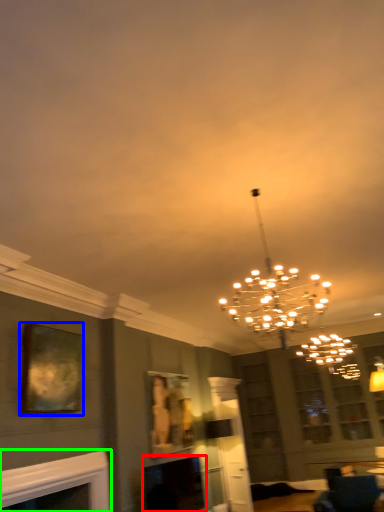
Question: Estimate the real-world distances between objects in this image. Which object is farther from fireplace (highlighted by a red box), picture frame (highlighted by a blue box) or fireplace (highlighted by a green box)?

Choices:
 (A) picture frame
 (B) fireplace

Answer: (A)